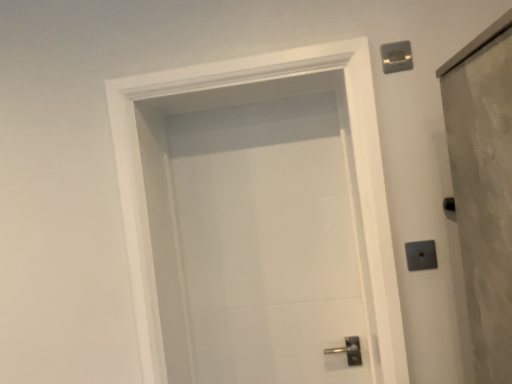
The image size is (512, 384). What do you see at coordinates (167, 188) in the screenshot?
I see `white matte door at center` at bounding box center [167, 188].

Measure the distance between point (144, 294) and camera.

They are 4.66 feet apart.

In order to face white matte door at center, should I rotate leftwards or rightwards?

You should look left and rotate roughly 0.736 degrees.

At what (x,y) coordinates should I click in order to perform the action: click on white matte door at center. Please return your answer as a coordinate pair (x, y). The width and height of the screenshot is (512, 384). Looking at the image, I should click on (167, 188).

Where is `white matte door at center`? white matte door at center is located at coordinates (167, 188).